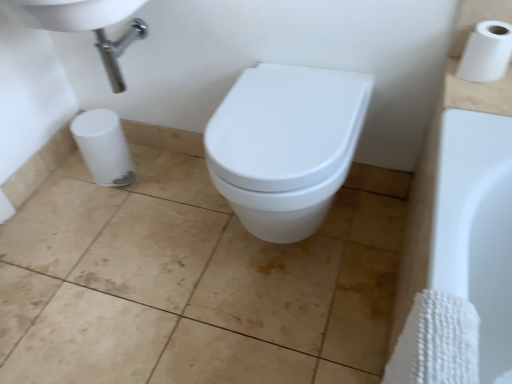
What do you see at coordinates (85, 25) in the screenshot? This screenshot has width=512, height=384. I see `white glossy sink at upper left` at bounding box center [85, 25].

The height and width of the screenshot is (384, 512). What do you see at coordinates (486, 52) in the screenshot?
I see `white matte toilet paper at upper right` at bounding box center [486, 52].

The width and height of the screenshot is (512, 384). Describe the element at coordinates (285, 146) in the screenshot. I see `white glossy toilet at center` at that location.

The height and width of the screenshot is (384, 512). Identify the location of beige ceramic tile at center. (190, 284).

This screenshot has height=384, width=512. Identify the location of white glossy sink at upper left. (85, 25).

Is white matte toilet paper at upper right closer to camera compared to white glossy sink at upper left?

No.

Could you tell me if white matte toilet paper at upper right is facing white glossy sink at upper left?

No, white matte toilet paper at upper right does not turn towards white glossy sink at upper left.

Is white glossy sink at upper left a part of white matte toilet paper at upper right?

No, white glossy sink at upper left is not inside white matte toilet paper at upper right.

Based on the photo, from the image's perspective, who appears lower, white matte toilet paper at upper right or white glossy sink at upper left?

white matte toilet paper at upper right, from the image's perspective.

What's the angular difference between white glossy sink at upper left and white glossy toilet at center's facing directions?

white glossy sink at upper left and white glossy toilet at center are facing 0.132 degrees away from each other.

Is white glossy sink at upper left situated inside white glossy toilet at center or outside?

white glossy sink at upper left exists outside the volume of white glossy toilet at center.

Which object is closer to the camera, white glossy sink at upper left or white glossy toilet at center?

white glossy toilet at center is closer to the camera.

Which of these two, white glossy toilet at center or beige ceramic tile at center, is thinner?

white glossy toilet at center.

In the scene shown: Are white glossy toilet at center and beige ceramic tile at center beside each other?

No, white glossy toilet at center is not making contact with beige ceramic tile at center.

Considering the positions of point (321, 152) and point (208, 267), is point (321, 152) closer or farther from the camera than point (208, 267)?

Point (321, 152) is closer to the camera than point (208, 267).

From a real-world perspective, does white glossy toilet at center stand above beige ceramic tile at center?

Yes, from a real-world perspective, white glossy toilet at center is on top of beige ceramic tile at center.

Can we say beige ceramic tile at center lies outside white glossy toilet at center?

Yes, beige ceramic tile at center is located beyond the bounds of white glossy toilet at center.

Identify the location of ceramic tile beneath the white glossy toilet at center (from a real-world perspective). (190, 284).

From a real-world perspective, is beige ceramic tile at center located higher than white glossy toilet at center?

Incorrect, from a real-world perspective, beige ceramic tile at center is lower than white glossy toilet at center.

Is beige ceramic tile at center turned away from white glossy toilet at center?

No, beige ceramic tile at center's orientation is not away from white glossy toilet at center.

From a real-world perspective, is white glossy toilet at center beneath white glossy sink at upper left?

Yes, from a real-world perspective, white glossy toilet at center is below white glossy sink at upper left.

You are a GUI agent. You are given a task and a screenshot of the screen. Output one action in this format:
    pyautogui.click(x=<x>, y=<y>)
    Task: Click on the toilet located below the white glossy sink at upper left (from the image's perspective)
    
    Given the screenshot: What is the action you would take?
    pyautogui.click(x=285, y=146)

In terms of width, does white glossy toilet at center look wider or thinner when compared to white glossy sink at upper left?

Considering their sizes, white glossy toilet at center looks broader than white glossy sink at upper left.

Can you see white glossy toilet at center touching white glossy sink at upper left?

white glossy toilet at center and white glossy sink at upper left are not in contact.

Between white matte toilet paper at upper right and white glossy toilet at center, which one is positioned in front?

white glossy toilet at center is in front.

Is white matte toilet paper at upper right looking in the opposite direction of white glossy toilet at center?

white matte toilet paper at upper right is not turned away from white glossy toilet at center.

Does white matte toilet paper at upper right touch white glossy toilet at center?

white matte toilet paper at upper right and white glossy toilet at center are not in contact.

Is white glossy sink at upper left positioned with its back to beige ceramic tile at center?

white glossy sink at upper left is not turned away from beige ceramic tile at center.

Is there a large distance between white glossy sink at upper left and beige ceramic tile at center?

No, there isn't a large distance between white glossy sink at upper left and beige ceramic tile at center.

From a real-world perspective, is white glossy sink at upper left on top of beige ceramic tile at center?

Yes, from a real-world perspective, white glossy sink at upper left is above beige ceramic tile at center.

The width and height of the screenshot is (512, 384). I want to click on ceramic tile located underneath the white glossy sink at upper left (from a real-world perspective), so click(x=190, y=284).

Identify the location of sink in front of the white matte toilet paper at upper right. Image resolution: width=512 pixels, height=384 pixels. (85, 25).

Where is `toilet below the white glossy sink at upper left (from the image's perspective)`? This screenshot has height=384, width=512. toilet below the white glossy sink at upper left (from the image's perspective) is located at coordinates (285, 146).

When comparing their distances from white matte toilet paper at upper right, does white glossy sink at upper left or white glossy toilet at center seem further?

white glossy sink at upper left is further to white matte toilet paper at upper right.

In the scene shown: Based on their spatial positions, is white glossy toilet at center or white matte toilet paper at upper right further from beige ceramic tile at center?

Among the two, white matte toilet paper at upper right is located further to beige ceramic tile at center.

Based on the photo, based on their spatial positions, is white matte toilet paper at upper right or white glossy sink at upper left closer to beige ceramic tile at center?

The object closer to beige ceramic tile at center is white glossy sink at upper left.

Based on their spatial positions, is white glossy sink at upper left or beige ceramic tile at center closer to white matte toilet paper at upper right?

white glossy sink at upper left is closer to white matte toilet paper at upper right.

Considering their positions, is white matte toilet paper at upper right positioned closer to white glossy toilet at center than beige ceramic tile at center?

Among the two, white matte toilet paper at upper right is located nearer to white glossy toilet at center.

When comparing their distances from white glossy toilet at center, does white glossy sink at upper left or beige ceramic tile at center seem closer?

Based on the image, beige ceramic tile at center appears to be nearer to white glossy toilet at center.

Estimate the real-world distances between objects in this image. Which object is further from beige ceramic tile at center, white matte toilet paper at upper right or white glossy toilet at center?

white matte toilet paper at upper right is positioned further to the anchor beige ceramic tile at center.

Estimate the real-world distances between objects in this image. Which object is further from white glossy toilet at center, white matte toilet paper at upper right or white glossy sink at upper left?

Among the two, white glossy sink at upper left is located further to white glossy toilet at center.

Image resolution: width=512 pixels, height=384 pixels. I want to click on toilet between white glossy sink at upper left and beige ceramic tile at center in the vertical direction, so click(285, 146).

You are a GUI agent. You are given a task and a screenshot of the screen. Output one action in this format:
    pyautogui.click(x=<x>, y=<y>)
    Task: Click on the ceramic tile between white glossy sink at upper left and white matte toilet paper at upper right
    Image resolution: width=512 pixels, height=384 pixels.
    Given the screenshot: What is the action you would take?
    pyautogui.click(x=190, y=284)

The width and height of the screenshot is (512, 384). Find the location of `toilet located between beige ceramic tile at center and white matte toilet paper at upper right in the left-right direction`. toilet located between beige ceramic tile at center and white matte toilet paper at upper right in the left-right direction is located at coordinates (285, 146).

At what (x,y) coordinates should I click in order to perform the action: click on toilet situated between white glossy sink at upper left and white matte toilet paper at upper right from left to right. Please return your answer as a coordinate pair (x, y). Looking at the image, I should click on (285, 146).